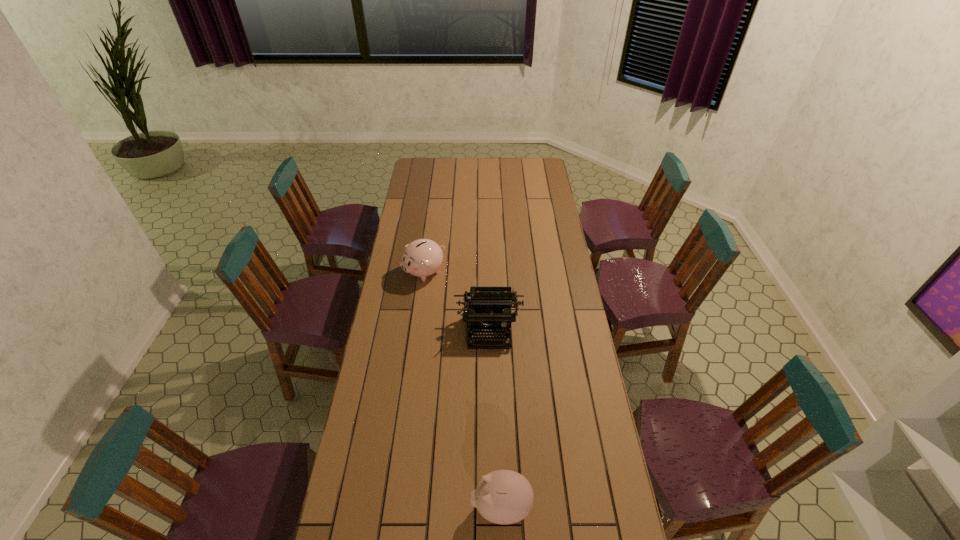
Identify the location of free space between the right piggy bank and the typewriter. The image size is (960, 540). (494, 418).

Find the location of a particular element. The image size is (960, 540). free space between the right piggy bank and the typewriter is located at coordinates (494, 418).

Where is `free space between the nearer piggy bank and the second nearest object`? free space between the nearer piggy bank and the second nearest object is located at coordinates (494, 418).

Identify the location of free point between the farther piggy bank and the second farthest object. (457, 301).

You are a GUI agent. You are given a task and a screenshot of the screen. Output one action in this format:
    pyautogui.click(x=<x>, y=<y>)
    Task: Click on the vacant space that's between the second nearest object and the nearest object
    This screenshot has height=540, width=960.
    Given the screenshot: What is the action you would take?
    pyautogui.click(x=494, y=418)

Locate which object ranks in proximity to the typewriter. Please provide its 2D coordinates. Your answer should be formatted as a tuple, i.e. [(x, y)], where the tuple contains the x and y coordinates of a point satisfying the conditions above.

[(423, 257)]

This screenshot has width=960, height=540. Find the location of `object that is the closest to the farthest object`. object that is the closest to the farthest object is located at coordinates (492, 304).